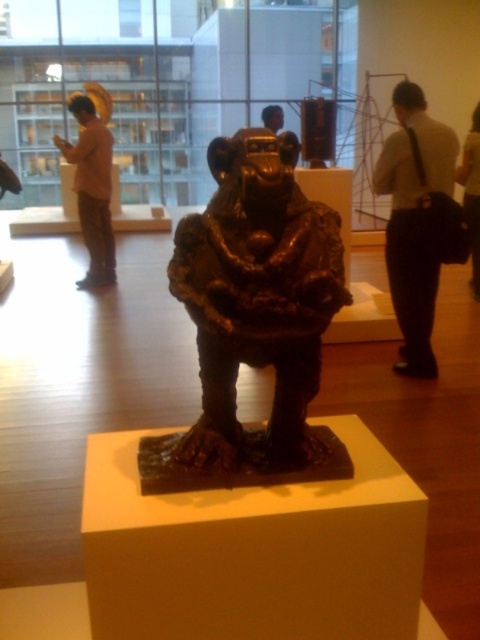
In the scene shown: You are a tour guide leading a group through the museum. You need to ensure that all visitors maintain a minimum distance of 1.8 meters apart for safety. There is a visitor wearing white shirt and black pants at right and another visitor in smooth black shirt at upper right. Can these two visitors stay where they are without violating the safety guidelines?

The distance between the white shirt and black pants at right and the smooth black shirt at upper right is 1.70 meters, which is less than the required 1.8 meters. Therefore, these two visitors need to move further apart to comply with the safety guidelines.

You are standing in the museum and want to take a photo of the bronze sculpture without any people in the frame. There is a person wearing white shirt and black pants at right. Where is the point at coordinate (414, 220) located on the person?

The point at coordinate (414, 220) is located on the white shirt and black pants at right.